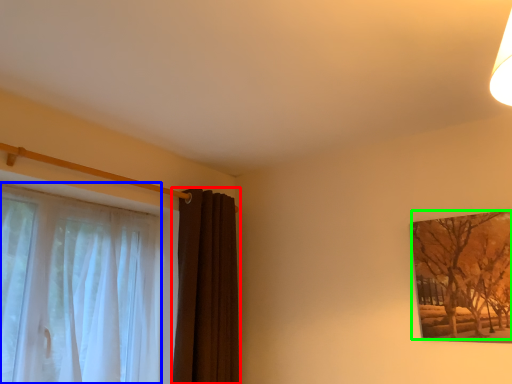
Question: Estimate the real-world distances between objects in this image. Which object is closer to curtain (highlighted by a red box), curtain (highlighted by a blue box) or tree (highlighted by a green box)?

Choices:
 (A) curtain
 (B) tree

Answer: (A)